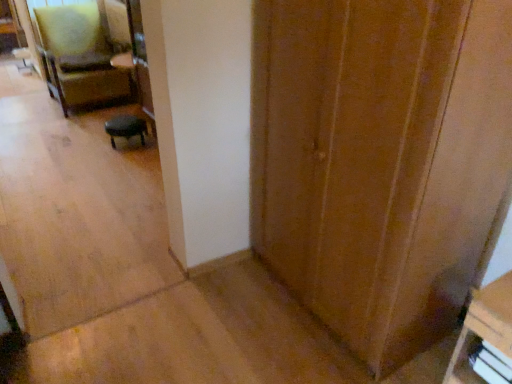
The height and width of the screenshot is (384, 512). Find the location of `wooden bookshelf at lower right, arranged as the first furniture when viewed from the front`. wooden bookshelf at lower right, arranged as the first furniture when viewed from the front is located at coordinates (484, 327).

What is the approximate width of wooden door at center?

63.30 centimeters.

Where is `velvet green armchair at upper left`? This screenshot has height=384, width=512. velvet green armchair at upper left is located at coordinates (79, 56).

What are the coordinates of `wooden bookshelf at lower right, arranged as the first furniture when viewed from the front` in the screenshot? It's located at (484, 327).

From the image's perspective, does wooden door at center appear lower than black leather stool at center, which is counted as the second furniture, starting from the right?

Yes, from the image's perspective, wooden door at center is beneath black leather stool at center, which is counted as the second furniture, starting from the right.

Is point (301, 128) closer to viewer compared to point (124, 129)?

That is True.

Is wooden door at center to the right of black leather stool at center, the first furniture positioned from the top, from the viewer's perspective?

Indeed, wooden door at center is positioned on the right side of black leather stool at center, the first furniture positioned from the top.

Is wooden door at center positioned in front of black leather stool at center, the second furniture in the bottom-to-top sequence?

Yes, wooden door at center is closer to the camera.

The height and width of the screenshot is (384, 512). Find the location of `drawer behind the wooden door at center`. drawer behind the wooden door at center is located at coordinates click(x=490, y=326).

From a real-world perspective, is white plastic drawer at lower right positioned under wooden door at center based on gravity?

Yes, from a real-world perspective, white plastic drawer at lower right is under wooden door at center.

How distant is white plastic drawer at lower right from wooden door at center?

white plastic drawer at lower right and wooden door at center are 59.71 centimeters apart.

Considering the sizes of objects white plastic drawer at lower right and wooden door at center in the image provided, who is bigger, white plastic drawer at lower right or wooden door at center?

Bigger between the two is wooden door at center.

How much distance is there between black leather stool at center, positioned as the 1th furniture in left-to-right order, and velvet green armchair at upper left?

black leather stool at center, positioned as the 1th furniture in left-to-right order, and velvet green armchair at upper left are 3.40 feet apart.

Is black leather stool at center, the second furniture in the bottom-to-top sequence, outside of velvet green armchair at upper left?

black leather stool at center, the second furniture in the bottom-to-top sequence, is positioned outside velvet green armchair at upper left.

From a real-world perspective, between black leather stool at center, the first furniture positioned from the top, and velvet green armchair at upper left, who is vertically lower?

black leather stool at center, the first furniture positioned from the top, is physically lower.

Is point (139, 118) closer or farther from the camera than point (53, 67)?

Point (139, 118) is closer to the camera than point (53, 67).

From the image's perspective, between white plastic drawer at lower right and wooden bookshelf at lower right, the second furniture viewed from the back, who is located below?

white plastic drawer at lower right, from the image's perspective.

Who is bigger, white plastic drawer at lower right or wooden bookshelf at lower right, arranged as the second furniture when viewed from the top?

Bigger between the two is wooden bookshelf at lower right, arranged as the second furniture when viewed from the top.

Considering the points (480, 318) and (459, 379), which point is in front, point (480, 318) or point (459, 379)?

The point (480, 318) is in front.

From a real-world perspective, which is physically below, white plastic drawer at lower right or wooden bookshelf at lower right, arranged as the 1th furniture when ordered from the bottom?

From a 3D spatial view, white plastic drawer at lower right is below.

Does wooden door at center have a lesser width compared to wooden bookshelf at lower right, arranged as the second furniture when viewed from the top?

No, wooden door at center is not thinner than wooden bookshelf at lower right, arranged as the second furniture when viewed from the top.

From a real-world perspective, between wooden door at center and wooden bookshelf at lower right, the second furniture viewed from the back, who is vertically higher?

From a 3D spatial view, wooden door at center is above.

Does wooden door at center lie in front of wooden bookshelf at lower right, arranged as the 1th furniture when ordered from the bottom?

Yes, it is in front of wooden bookshelf at lower right, arranged as the 1th furniture when ordered from the bottom.

Is wooden door at center situated inside wooden bookshelf at lower right, the 1th furniture from the right, or outside?

wooden door at center lies outside wooden bookshelf at lower right, the 1th furniture from the right.

Which is more to the right, velvet green armchair at upper left or white plastic drawer at lower right?

From the viewer's perspective, white plastic drawer at lower right appears more on the right side.

Consider the image. From the image's perspective, is velvet green armchair at upper left located above white plastic drawer at lower right?

Indeed, from the image's perspective, velvet green armchair at upper left is shown above white plastic drawer at lower right.

Is velvet green armchair at upper left placed right next to white plastic drawer at lower right?

velvet green armchair at upper left is not next to white plastic drawer at lower right, and they're not touching.

From a real-world perspective, does velvet green armchair at upper left sit lower than white plastic drawer at lower right?

Actually, velvet green armchair at upper left is physically above white plastic drawer at lower right in the real world.

Considering the sizes of objects wooden bookshelf at lower right, arranged as the 1th furniture when ordered from the bottom, and velvet green armchair at upper left in the image provided, who is bigger, wooden bookshelf at lower right, arranged as the 1th furniture when ordered from the bottom, or velvet green armchair at upper left?

With larger size is velvet green armchair at upper left.

In the scene shown: From a real-world perspective, between wooden bookshelf at lower right, arranged as the second furniture when viewed from the top, and velvet green armchair at upper left, who is vertically higher?

In real-world perspective, velvet green armchair at upper left is above.

In terms of width, does wooden bookshelf at lower right, arranged as the second furniture when viewed from the top, look wider or thinner when compared to velvet green armchair at upper left?

Considering their sizes, wooden bookshelf at lower right, arranged as the second furniture when viewed from the top, looks slimmer than velvet green armchair at upper left.

Where is `furniture that appears above the wooden door at center (from the image's perspective)`? furniture that appears above the wooden door at center (from the image's perspective) is located at coordinates (125, 128).

The image size is (512, 384). I want to click on door in front of the white plastic drawer at lower right, so pos(379,160).

Estimate the real-world distances between objects in this image. Which object is closer to black leather stool at center, the first furniture positioned from the top, velvet green armchair at upper left or white plastic drawer at lower right?

Among the two, velvet green armchair at upper left is located nearer to black leather stool at center, the first furniture positioned from the top.

Which object lies nearer to the anchor point black leather stool at center, the first furniture positioned from the top, white plastic drawer at lower right or velvet green armchair at upper left?

Based on the image, velvet green armchair at upper left appears to be nearer to black leather stool at center, the first furniture positioned from the top.

Based on their spatial positions, is velvet green armchair at upper left or wooden bookshelf at lower right, the 1th furniture from the right, further from white plastic drawer at lower right?

The object further to white plastic drawer at lower right is velvet green armchair at upper left.

When comparing their distances from wooden bookshelf at lower right, arranged as the second furniture when viewed from the top, does black leather stool at center, which is counted as the second furniture, starting from the right, or velvet green armchair at upper left seem further?

velvet green armchair at upper left is further to wooden bookshelf at lower right, arranged as the second furniture when viewed from the top.

Which object lies nearer to the anchor point white plastic drawer at lower right, velvet green armchair at upper left or wooden door at center?

wooden door at center is positioned closer to the anchor white plastic drawer at lower right.

From the image, which object appears to be farther from wooden door at center, black leather stool at center, positioned as the 1th furniture in left-to-right order, or white plastic drawer at lower right?

Based on the image, black leather stool at center, positioned as the 1th furniture in left-to-right order, appears to be further to wooden door at center.

Looking at the image, which one is located further to black leather stool at center, the first furniture positioned from the top, wooden door at center or white plastic drawer at lower right?

The object further to black leather stool at center, the first furniture positioned from the top, is white plastic drawer at lower right.

When comparing their distances from velvet green armchair at upper left, does wooden door at center or wooden bookshelf at lower right, acting as the 2th furniture starting from the left, seem closer?

Based on the image, wooden door at center appears to be nearer to velvet green armchair at upper left.

Image resolution: width=512 pixels, height=384 pixels. Identify the location of furniture between wooden door at center and black leather stool at center, the first furniture positioned from the top, in the front-back direction. (484, 327).

At what (x,y) coordinates should I click in order to perform the action: click on furniture between velvet green armchair at upper left and white plastic drawer at lower right from left to right. Please return your answer as a coordinate pair (x, y). This screenshot has height=384, width=512. Looking at the image, I should click on (125, 128).

Find the location of a particular element. drawer between wooden door at center and black leather stool at center, the second furniture in the bottom-to-top sequence, in the front-back direction is located at coordinates (490, 326).

Image resolution: width=512 pixels, height=384 pixels. Identify the location of furniture between velvet green armchair at upper left and wooden bookshelf at lower right, arranged as the second furniture when viewed from the top. (125, 128).